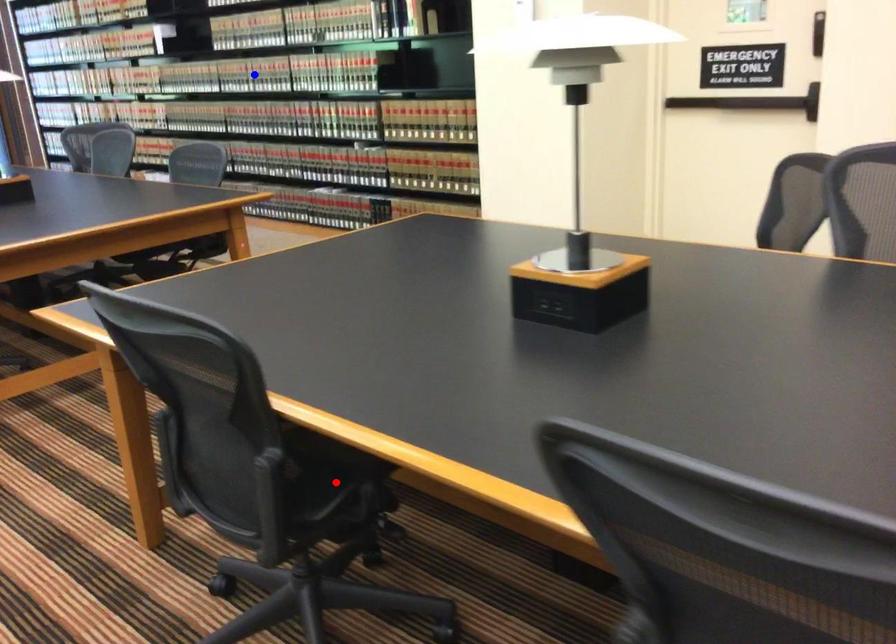
Question: Two points are marked on the image. Which point is closer to the camera?

Choices:
 (A) Blue point is closer.
 (B) Red point is closer.

Answer: (B)